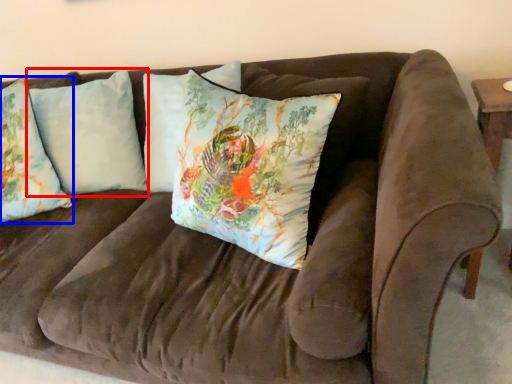
Question: Which object appears closest to the camera in this image, pillow (highlighted by a red box) or pillow (highlighted by a blue box)?

Choices:
 (A) pillow
 (B) pillow

Answer: (B)